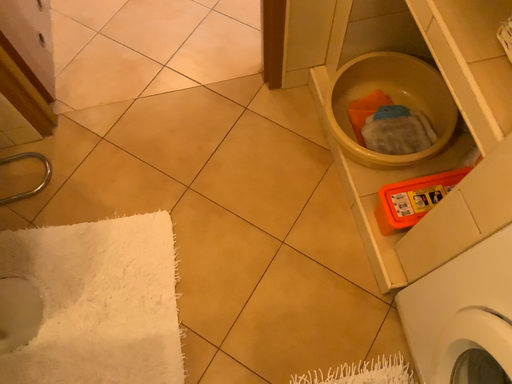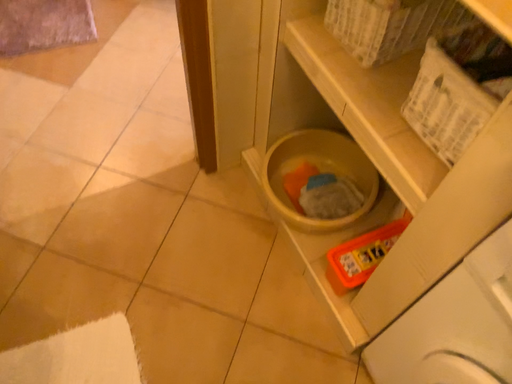
Question: Which way did the camera rotate in the video?

Choices:
 (A) rotated downward
 (B) rotated upward

Answer: (B)